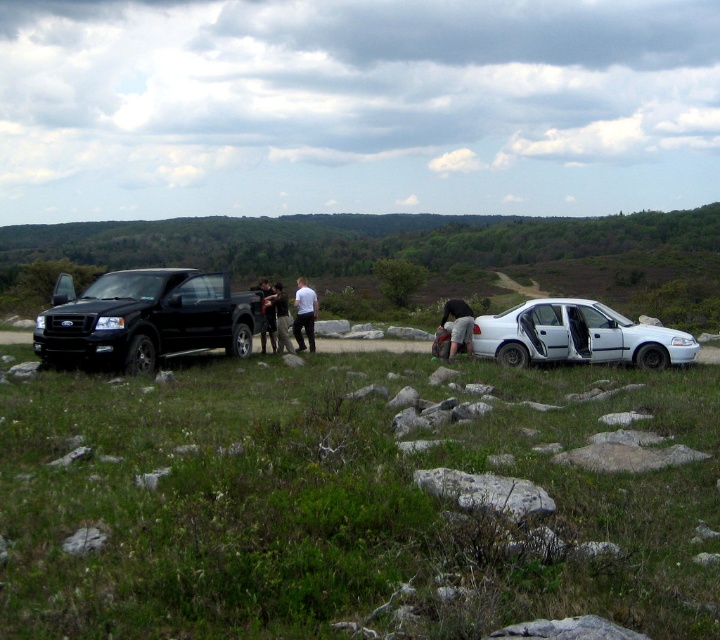
You are a hiker who just arrived at the scene and need to find your friend wearing a dark gray fabric jacket at center. You see the black matte truck at left. Which direction should you walk from the truck to find your friend?

The black matte truck at left is positioned on the left side of dark gray fabric jacket at center, so you should walk to the right from the truck to find your friend wearing the dark gray fabric jacket at center.

You are standing at the point labeled point (x=276, y=349) and want to walk towards the point labeled point (x=127, y=333). Which direction should you face to move directly towards it?

You should face north to move directly towards point (x=127, y=333) from point (x=276, y=349) because it is in front of the latter point.